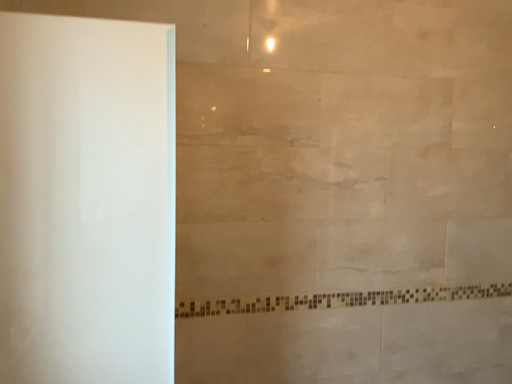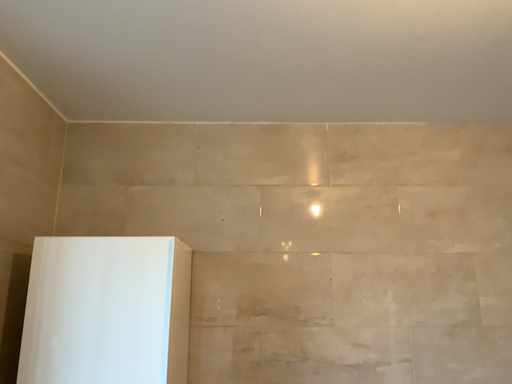
Question: How did the camera likely rotate when shooting the video?

Choices:
 (A) rotated left
 (B) rotated right

Answer: (A)